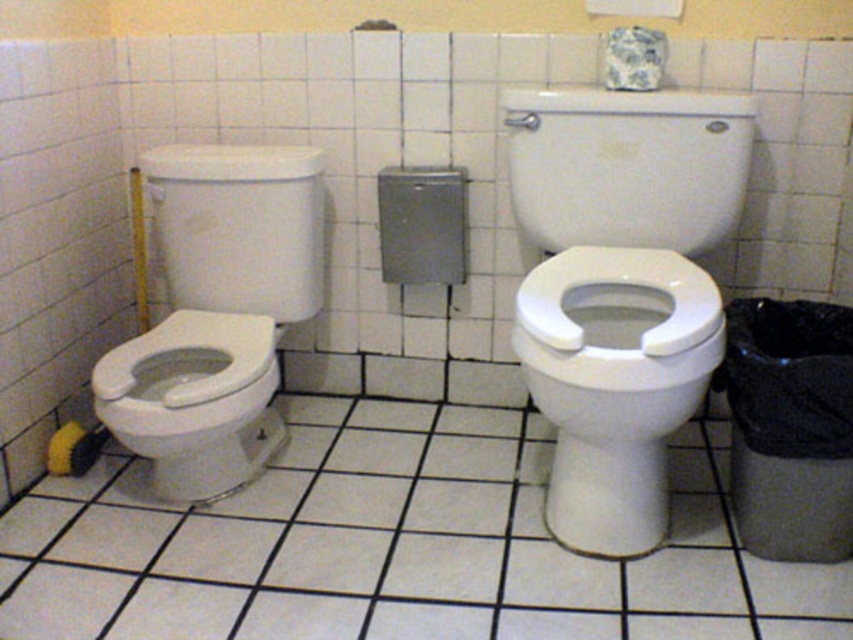
Is blue and white ceramic toilet paper at upper center to the left of yellow fabric toilet paper at lower left from the viewer's perspective?

In fact, blue and white ceramic toilet paper at upper center is to the right of yellow fabric toilet paper at lower left.

Locate an element on the screen. This screenshot has height=640, width=853. blue and white ceramic toilet paper at upper center is located at coordinates (633, 58).

Identify the location of blue and white ceramic toilet paper at upper center. This screenshot has width=853, height=640. (633, 58).

Who is higher up, white glossy toilet at upper center or white glossy toilet at left?

white glossy toilet at upper center

Image resolution: width=853 pixels, height=640 pixels. Describe the element at coordinates (621, 288) in the screenshot. I see `white glossy toilet at upper center` at that location.

Where is `white glossy toilet at upper center`? white glossy toilet at upper center is located at coordinates (621, 288).

Find the location of a particular element. Image resolution: width=853 pixels, height=640 pixels. white glossy toilet at left is located at coordinates (218, 314).

Looking at this image, is white glossy toilet at left below blue and white ceramic toilet paper at upper center?

Indeed, white glossy toilet at left is positioned under blue and white ceramic toilet paper at upper center.

Is point (148, 193) less distant than point (614, 68)?

No, it is not.

At what (x,y) coordinates should I click in order to perform the action: click on white glossy toilet at left. Please return your answer as a coordinate pair (x, y). Looking at the image, I should click on (218, 314).